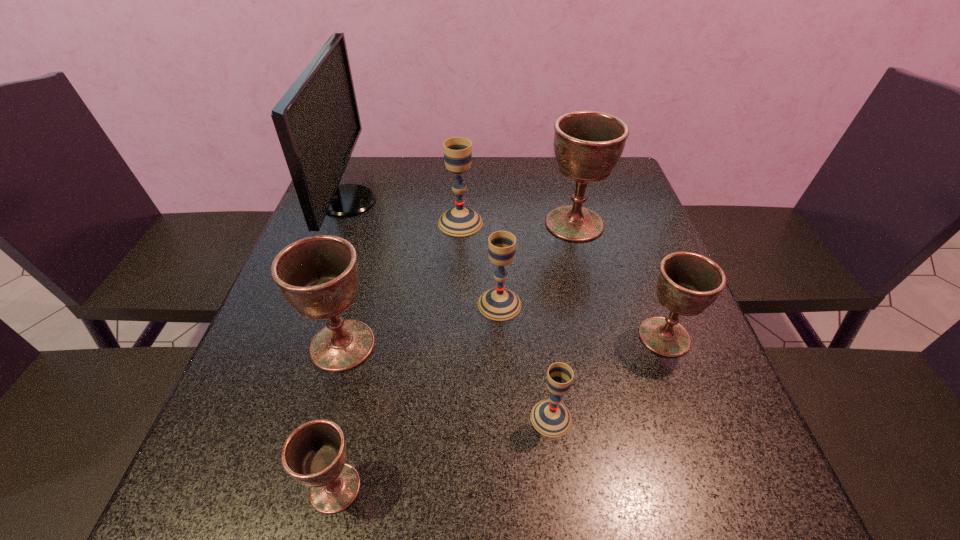
This screenshot has width=960, height=540. In order to click on object situated at the far edge in this screenshot , I will do `click(317, 121)`.

Find the location of a particular element. The width and height of the screenshot is (960, 540). object that is at the near edge is located at coordinates (314, 454).

Image resolution: width=960 pixels, height=540 pixels. What are the coordinates of `computer monitor that is at the left edge` in the screenshot? It's located at click(x=317, y=121).

Locate an element on the screen. chalice that is at the left edge is located at coordinates (318, 275).

In order to click on object that is at the far left corner in this screenshot , I will do `click(317, 121)`.

Identify the location of vacant space at the far edge of the desktop. (540, 179).

Locate an element on the screen. This screenshot has width=960, height=540. free space at the near edge of the desktop is located at coordinates pos(365,484).

Identify the location of free point at the left edge. (278, 312).

Where is `blank space at the right edge`? This screenshot has height=540, width=960. blank space at the right edge is located at coordinates (653, 228).

In the image, there is a desktop. What are the coordinates of `vacant space at the far left corner` in the screenshot? It's located at (359, 161).